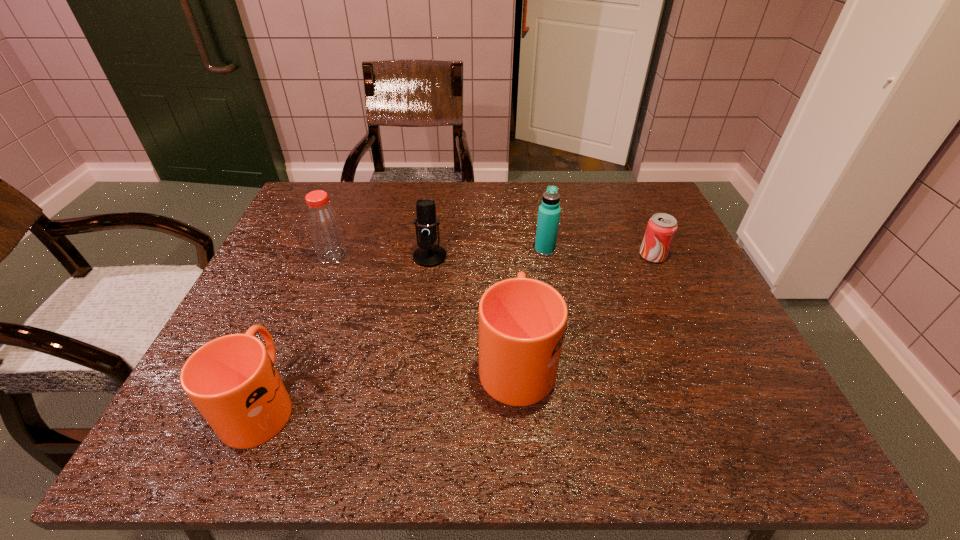
This screenshot has height=540, width=960. Find the location of `object at the near left corner`. object at the near left corner is located at coordinates (232, 380).

In the image, there is a desktop. Where is `vacant space at the far edge`? vacant space at the far edge is located at coordinates (496, 190).

This screenshot has height=540, width=960. What are the coordinates of `vacant space at the near edge of the desktop` in the screenshot? It's located at (573, 370).

In the image, there is a desktop. Where is `free region at the left edge`? free region at the left edge is located at coordinates (258, 314).

What are the coordinates of `free point at the right edge` in the screenshot? It's located at (681, 291).

Where is `vacant space at the far left corner of the desktop`? The height and width of the screenshot is (540, 960). vacant space at the far left corner of the desktop is located at coordinates (347, 194).

Where is `vacant space at the far right corner of the desktop`? vacant space at the far right corner of the desktop is located at coordinates (654, 207).

Locate an element on the screen. The width and height of the screenshot is (960, 540). vacant space that is in between the shorter mug and the rightmost object is located at coordinates (457, 329).

Where is `free space between the shortest object and the bottle`? The height and width of the screenshot is (540, 960). free space between the shortest object and the bottle is located at coordinates (492, 256).

The image size is (960, 540). Find the location of `empty location between the left mug and the third object from left to right`. empty location between the left mug and the third object from left to right is located at coordinates (346, 329).